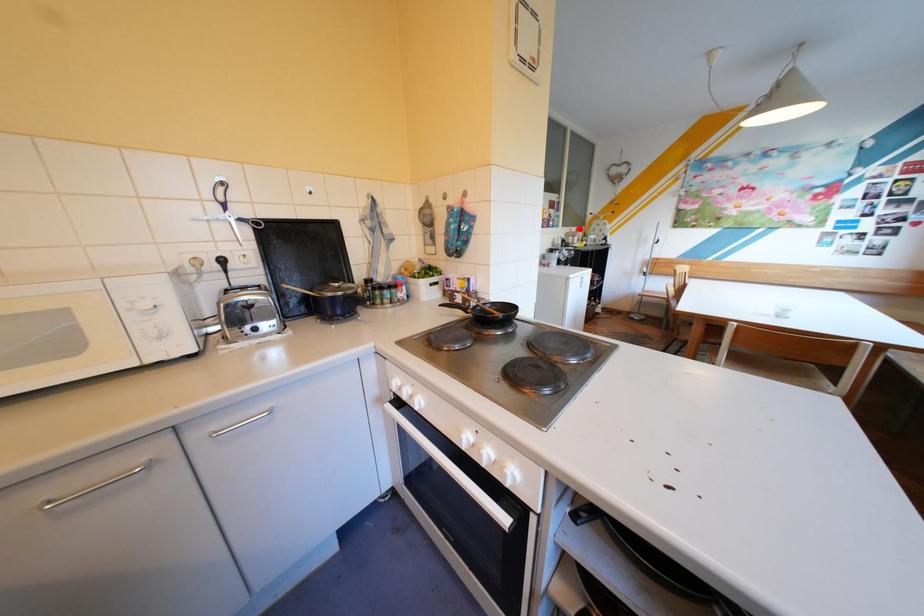
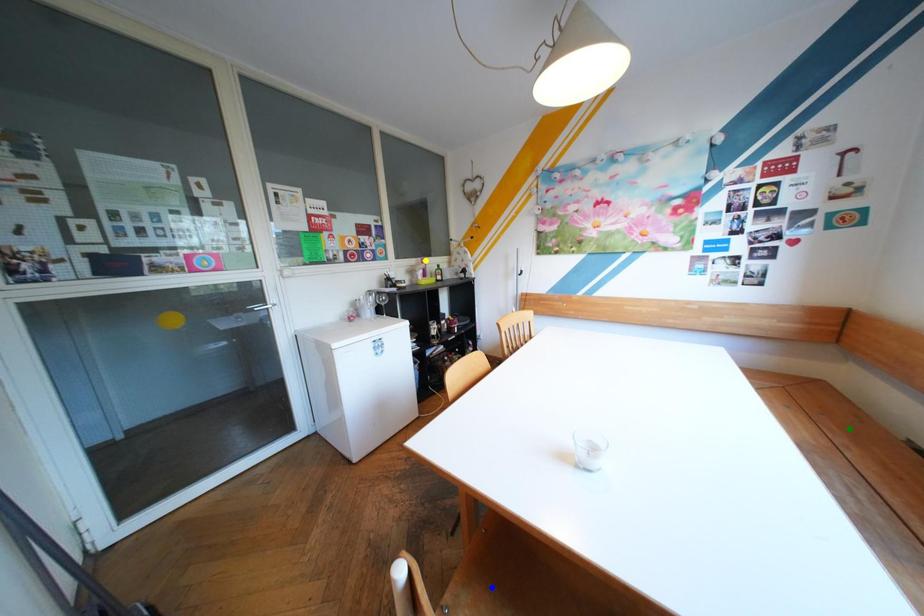
Question: I am providing you with two images of the same scene from different viewpoints. A red point is marked on the first image. You are given multiple points on the second image. Which point in image 2 represents the same 3d spot as the red point in image 1?

Choices:
 (A) blue point
 (B) green point
 (C) yellow point

Answer: (C)